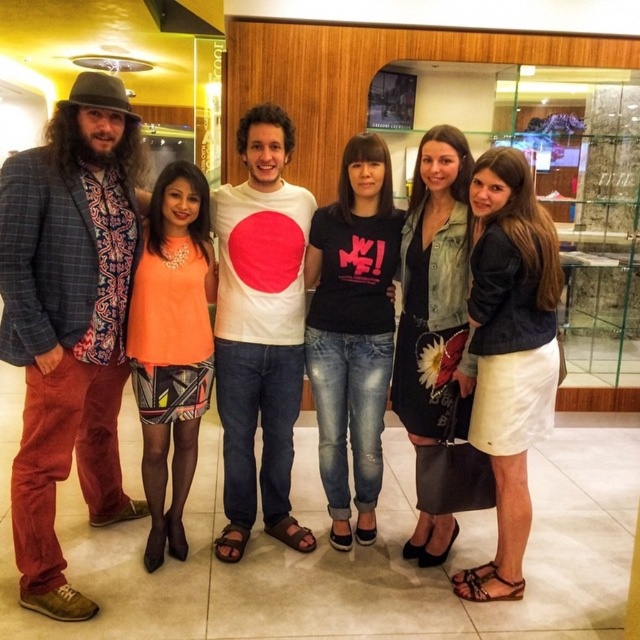
Between point (269, 444) and point (163, 230), which one is positioned in front?

Positioned in front is point (163, 230).

Can you confirm if white matte t-shirt at center is positioned below orange fabric dress at center?

No, white matte t-shirt at center is not below orange fabric dress at center.

Which is behind, point (253, 300) or point (161, 216)?

The point (253, 300) is more distant.

Identify the location of white matte t-shirt at center. (259, 330).

Find the location of a particular element. The image size is (640, 640). plaid wool blazer at left is located at coordinates (68, 323).

Is point (100, 256) in front of point (433, 324)?

Yes, point (100, 256) is closer to viewer.

What do you see at coordinates (68, 323) in the screenshot?
I see `plaid wool blazer at left` at bounding box center [68, 323].

Locate an element on the screen. This screenshot has height=640, width=640. plaid wool blazer at left is located at coordinates (68, 323).

Is point (500, 413) in front of point (182, 246)?

Yes, it is.

Does white cotton skirt at lower right lie in front of orange fabric dress at center?

Yes, it is.

The width and height of the screenshot is (640, 640). Describe the element at coordinates (509, 353) in the screenshot. I see `white cotton skirt at lower right` at that location.

Locate an element on the screen. The image size is (640, 640). white cotton skirt at lower right is located at coordinates (509, 353).